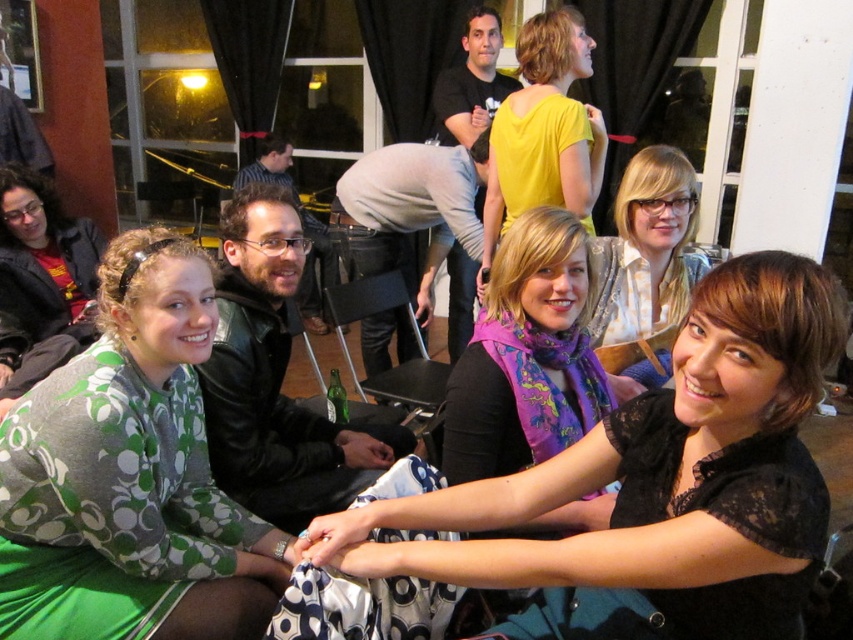
Which of these two, yellow matte shirt at upper center or matte white blouse at center, stands shorter?

matte white blouse at center is shorter.

Can you confirm if yellow matte shirt at upper center is smaller than matte white blouse at center?

No, yellow matte shirt at upper center is not smaller than matte white blouse at center.

This screenshot has height=640, width=853. What do you see at coordinates (544, 132) in the screenshot?
I see `yellow matte shirt at upper center` at bounding box center [544, 132].

The height and width of the screenshot is (640, 853). Find the location of `yellow matte shirt at upper center`. yellow matte shirt at upper center is located at coordinates (544, 132).

Is purple silk scarf at center below matte white blouse at center?

Indeed, purple silk scarf at center is positioned under matte white blouse at center.

Can you confirm if purple silk scarf at center is wider than matte white blouse at center?

No, purple silk scarf at center is not wider than matte white blouse at center.

Locate an element on the screen. purple silk scarf at center is located at coordinates (526, 356).

At what (x,y) coordinates should I click in order to perform the action: click on purple silk scarf at center. Please return your answer as a coordinate pair (x, y). This screenshot has height=640, width=853. Looking at the image, I should click on (526, 356).

Measure the distance between black lace shirt at center and matte white blouse at center.

The distance of black lace shirt at center from matte white blouse at center is 32.92 inches.

Between black lace shirt at center and matte white blouse at center, which one is positioned higher?

matte white blouse at center is higher up.

This screenshot has height=640, width=853. I want to click on black lace shirt at center, so click(x=660, y=476).

You are a GUI agent. You are given a task and a screenshot of the screen. Output one action in this format:
    pyautogui.click(x=<x>, y=<y>)
    Task: Click on the black lace shirt at center
    
    Given the screenshot: What is the action you would take?
    pyautogui.click(x=660, y=476)